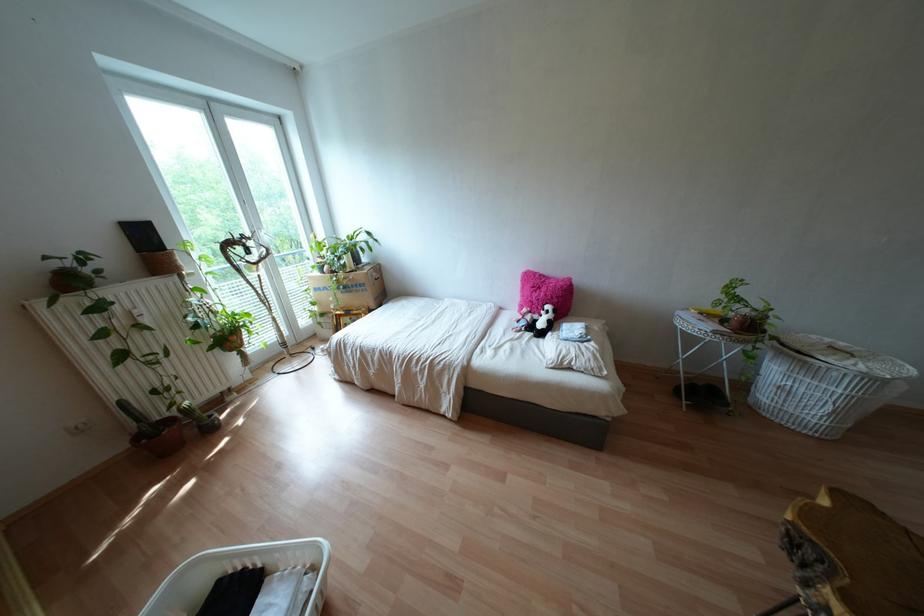
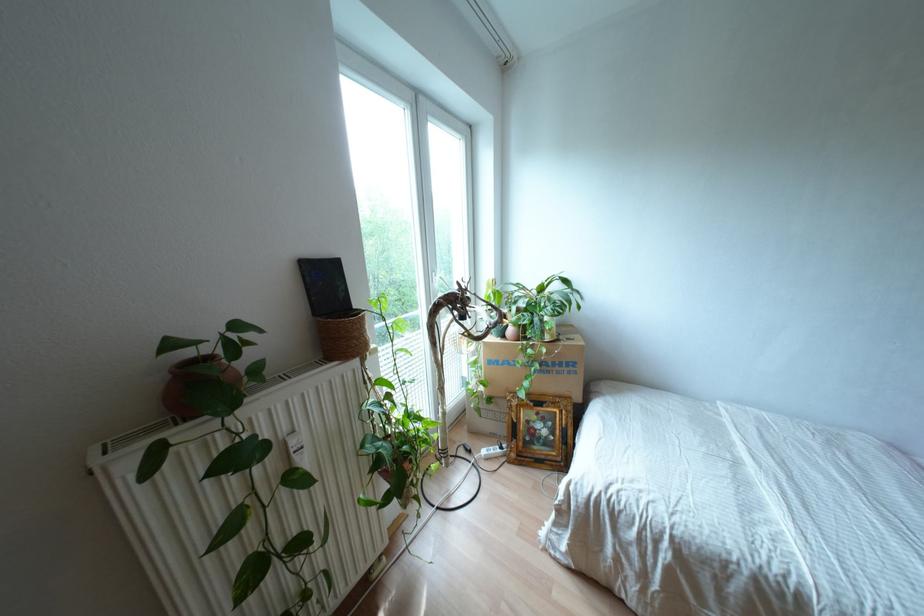
Find the pixel in the second image that matches (70,267) in the first image.

(210, 357)